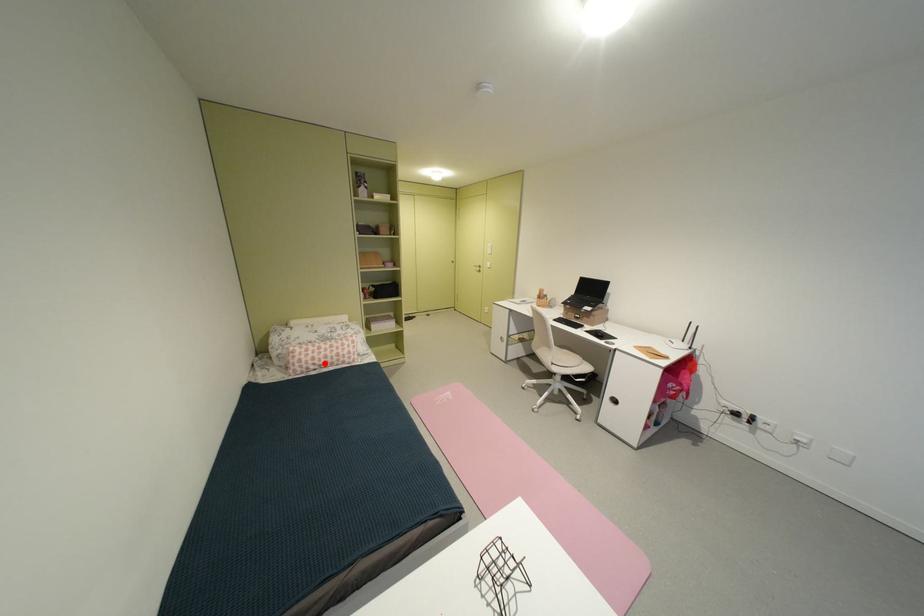
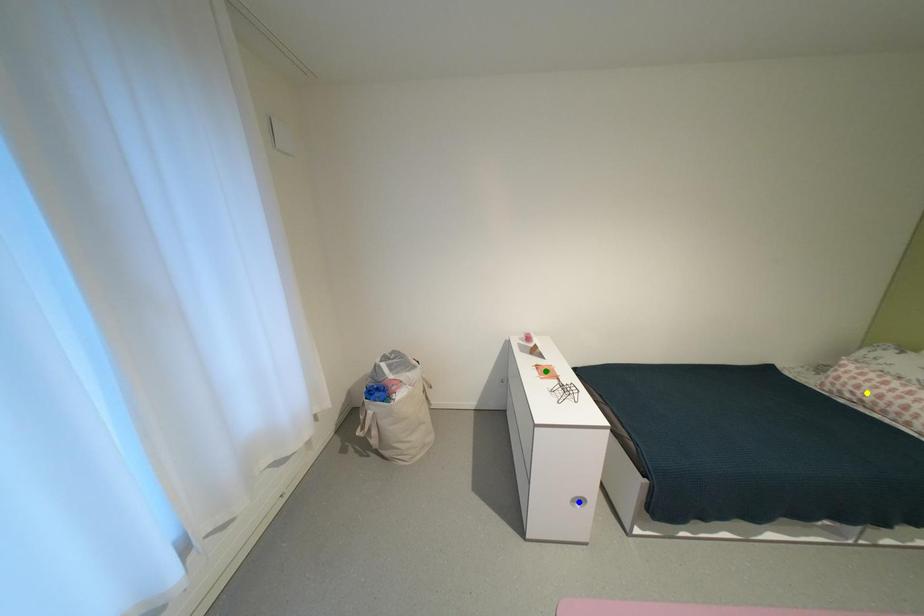
Question: I am providing you with two images of the same scene from different viewpoints. A red point is marked on the first image. You are given multiple points on the second image. Which point in image 2 represents the same 3d spot as the red point in image 1?

Choices:
 (A) blue point
 (B) yellow point
 (C) green point

Answer: (B)